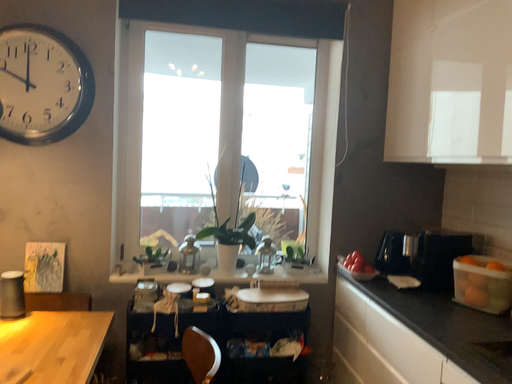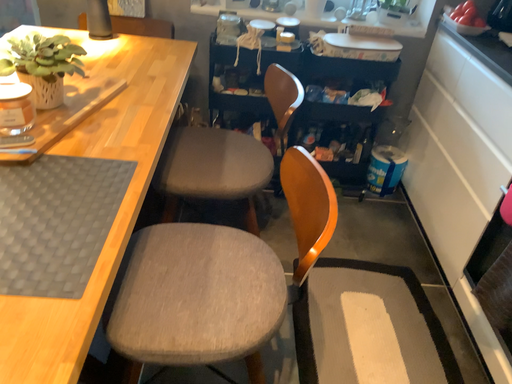
Question: Which way did the camera rotate in the video?

Choices:
 (A) rotated downward
 (B) rotated upward

Answer: (A)